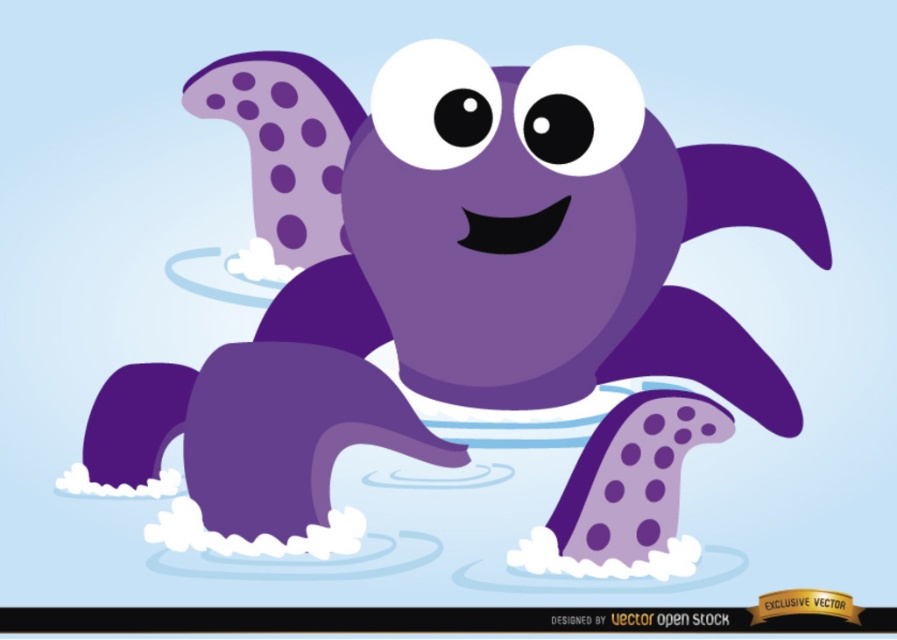
Question: Where is matte purple turtle at center located in relation to matte black eye at center in the image?

Choices:
 (A) right
 (B) left

Answer: (B)

Question: Is the position of matte purple turtle at center more distant than that of matte black eye at upper center?

Choices:
 (A) yes
 (B) no

Answer: (B)

Question: Which point is farther from the camera taking this photo?

Choices:
 (A) (564, 145)
 (B) (123, 448)

Answer: (B)

Question: Among these points, which one is farthest from the camera?

Choices:
 (A) (471, 93)
 (B) (408, 96)
 (C) (577, 150)

Answer: (B)

Question: Which of the following is the closest to the observer?

Choices:
 (A) (555, 113)
 (B) (401, 145)

Answer: (B)

Question: Can you confirm if matte purple turtle at center is positioned to the left of matte black eye at upper center?

Choices:
 (A) yes
 (B) no

Answer: (A)